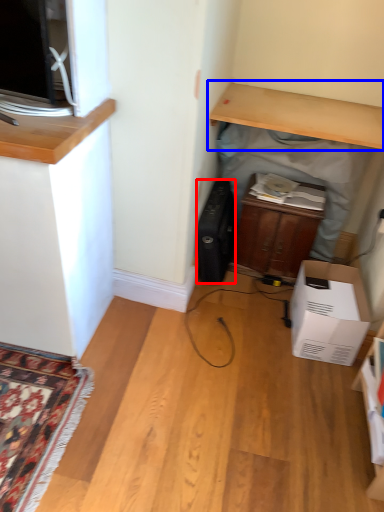
Question: Which of the following is the closest to the observer, appliance (highlighted by a red box) or desk (highlighted by a blue box)?

Choices:
 (A) appliance
 (B) desk

Answer: (B)